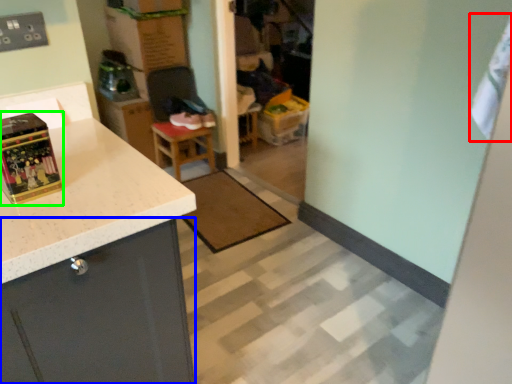
Question: Based on their relative distances, which object is farther from laundry (highlighted by a red box)? Choose from cabinetry (highlighted by a blue box) and box (highlighted by a green box).

Choices:
 (A) cabinetry
 (B) box

Answer: (B)